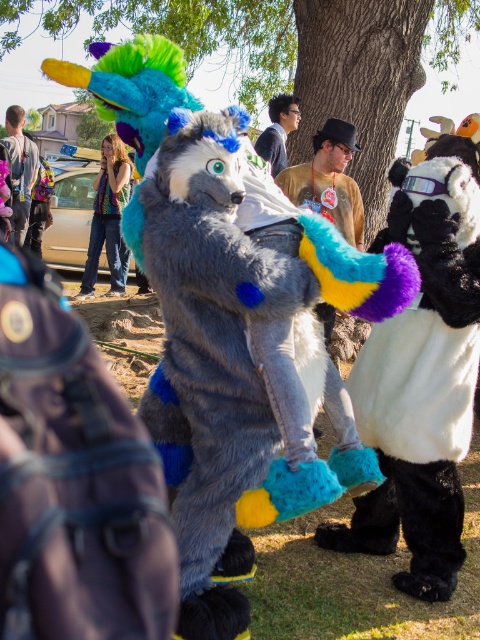
You are standing at the center of the scene and want to move towards the white fluffy costume at right. Which direction should you move to reach it?

Since the white fluffy costume at right is located at point 0.580 on the x axis and 0.881 on the y axis, you should move to the right and slightly upwards to reach it.

You are standing in the middle of the convention hall and see two points marked in the image. Which point, point (361,432) or point (324,144), is closer to you?

Point (361,432) is closer to the viewer than point (324,144).

You are organizing a parade route and need to ensure that the fluffy fur costume at center and the matte black backpack at left can pass through a narrow alleyway. The alleyway is only as wide as the wider of the two. Which object determines the minimum width required for the alleyway?

The fluffy fur costume at center determines the minimum width required for the alleyway because its width is larger than the matte black backpack at left.